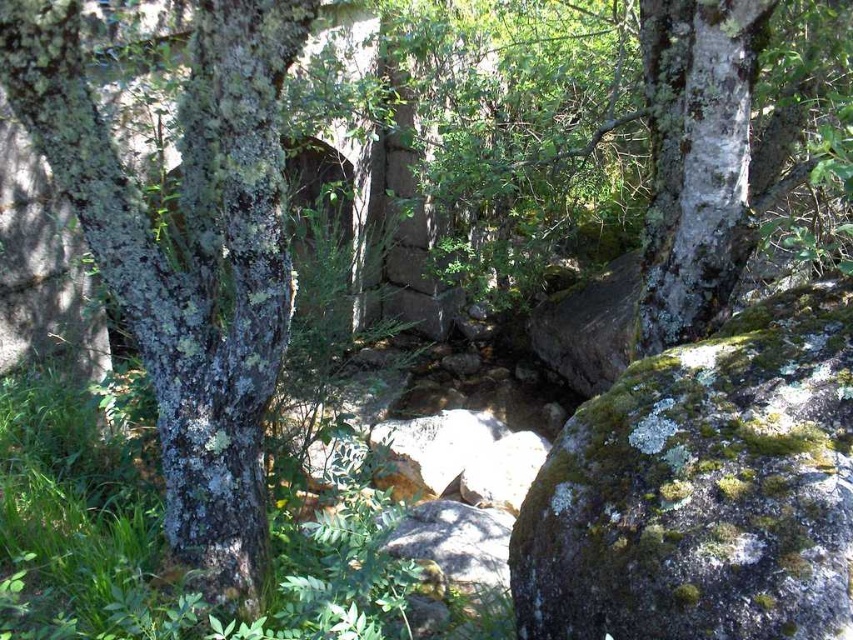
Is point (624, 458) less distant than point (744, 202)?

That is True.

Who is positioned more to the left, green mossy rock at center or white lichen-covered tree trunk at right?

Positioned to the left is green mossy rock at center.

I want to click on green mossy rock at center, so click(x=703, y=490).

In the scene shown: Who is positioned more to the left, speckled bark tree at center or white lichen-covered tree trunk at right?

From the viewer's perspective, speckled bark tree at center appears more on the left side.

Which is in front, point (187, 237) or point (683, 326)?

Point (187, 237)

Which is behind, point (258, 404) or point (695, 172)?

Point (695, 172)

Image resolution: width=853 pixels, height=640 pixels. Identify the location of speckled bark tree at center. (186, 256).

Can you confirm if green mossy rock at center is taller than speckled bark tree at center?

Incorrect, green mossy rock at center's height is not larger of speckled bark tree at center's.

Does point (540, 512) come behind point (223, 456)?

No, (540, 512) is in front of (223, 456).

The image size is (853, 640). I want to click on green mossy rock at center, so click(x=703, y=490).